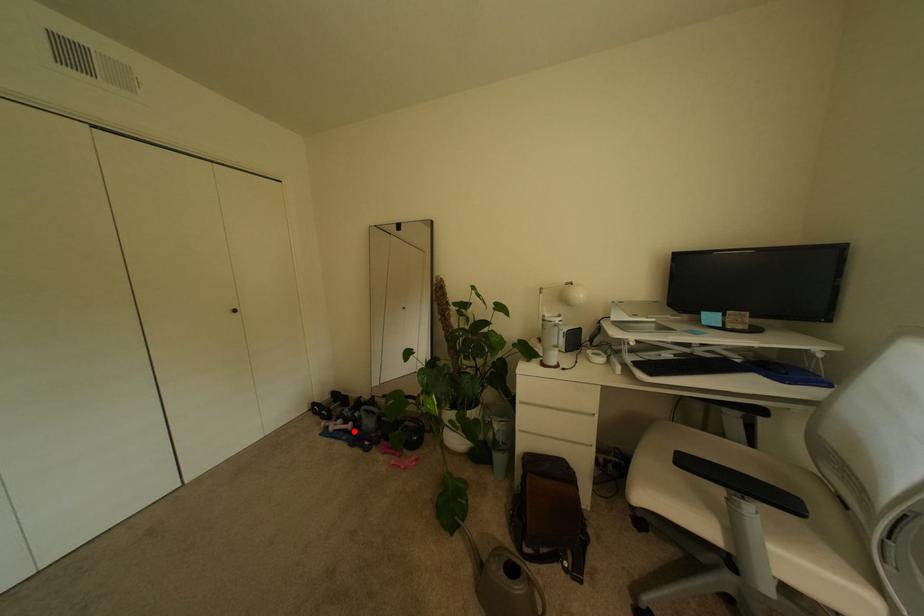
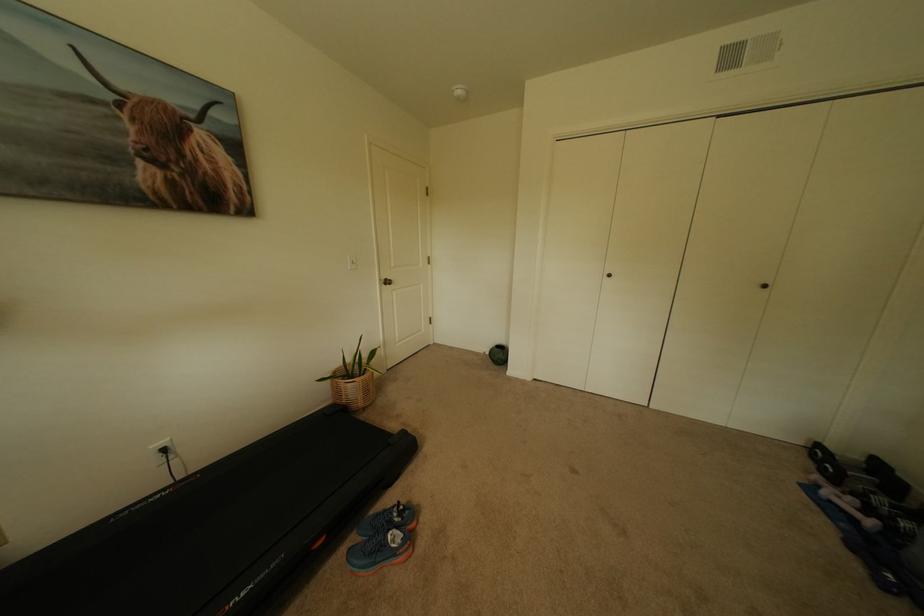
Question: I am providing you with two images of the same scene from different viewpoints. Image1 has a red point marked. In image2, the corresponding 3D location appears at what relative position? Reply with the corresponding letter.

Choices:
 (A) Closer
 (B) Farther

Answer: (A)